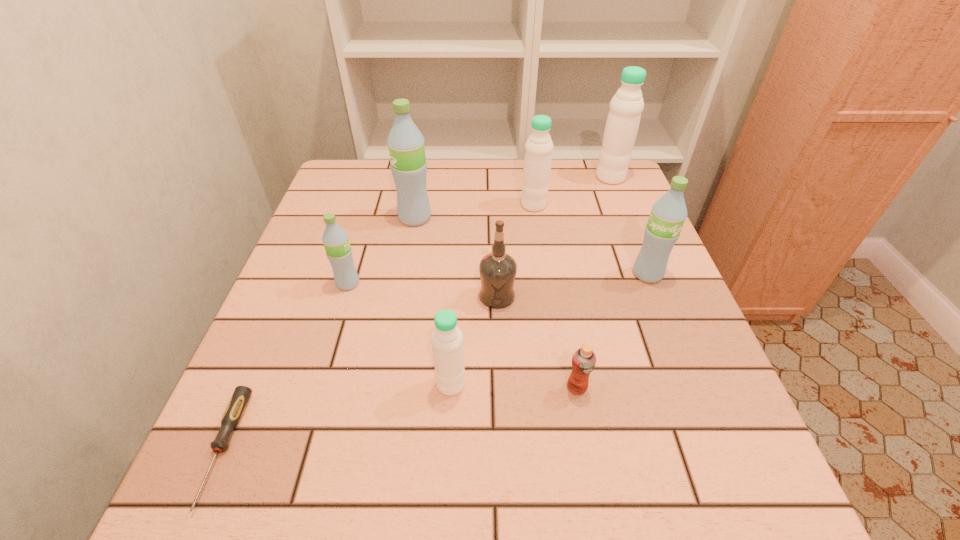
Identify the location of free region at the far edge. The image size is (960, 540). (504, 204).

Identify the location of free region at the near edge of the desktop. (592, 475).

Where is `vacant space at the left edge`? The height and width of the screenshot is (540, 960). vacant space at the left edge is located at coordinates (322, 276).

In the image, there is a desktop. Where is `vacant space at the right edge`? vacant space at the right edge is located at coordinates (642, 224).

Where is `blank region between the sixth object from right to left and the eighth object from right to left`? blank region between the sixth object from right to left and the eighth object from right to left is located at coordinates (399, 334).

You are a GUI agent. You are given a task and a screenshot of the screen. Output one action in this format:
    pyautogui.click(x=<x>, y=<y>)
    Task: Click on the vacant area between the biggest white water bottle and the biggest green water bottle
    The width and height of the screenshot is (960, 540).
    Given the screenshot: What is the action you would take?
    pyautogui.click(x=513, y=198)

The width and height of the screenshot is (960, 540). I want to click on free space between the fourth object from left to right and the vodka, so click(474, 340).

Find the location of a particular element. empty space that is in between the fifth object from left to right and the eighth tallest object is located at coordinates (537, 342).

Identify the location of unoccupied area between the second biggest green water bottle and the nearest water bottle. This screenshot has height=540, width=960. click(x=549, y=329).

Locate an element on the screen. empty location between the second white water bottle from right to left and the second shortest object is located at coordinates (555, 296).